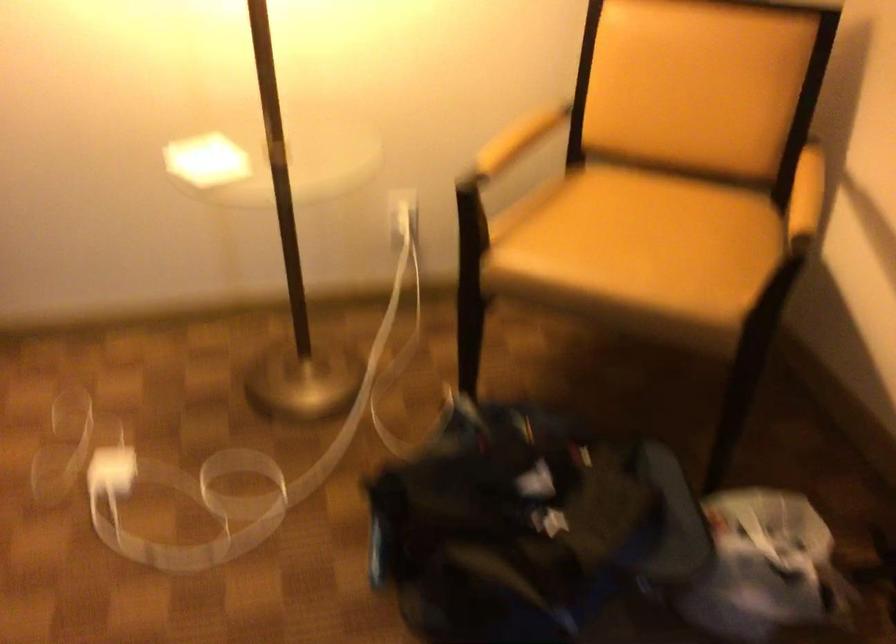
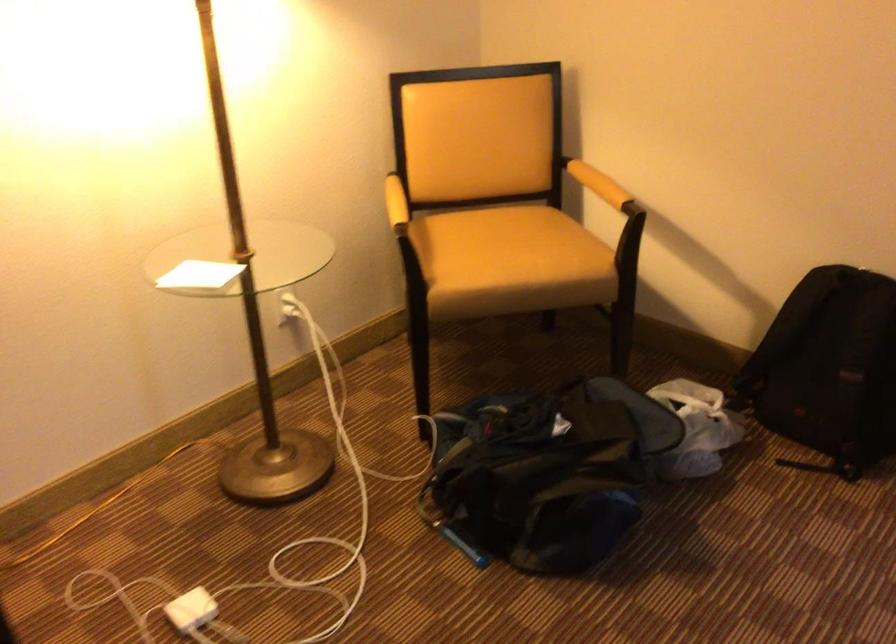
In the second image, find the point that corresponds to (x=108, y=478) in the first image.

(192, 609)